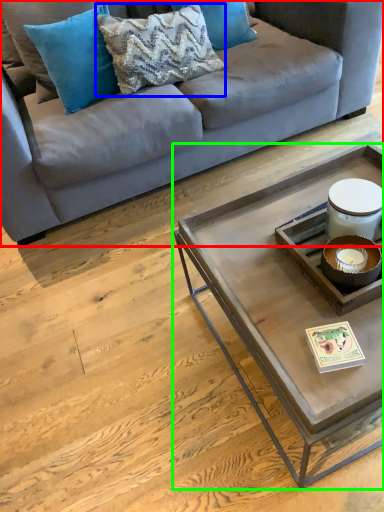
Question: Which object is the farthest from studio couch (highlighted by a red box)? Choose among these: pillow (highlighted by a blue box) or coffee table (highlighted by a green box).

Choices:
 (A) pillow
 (B) coffee table

Answer: (B)